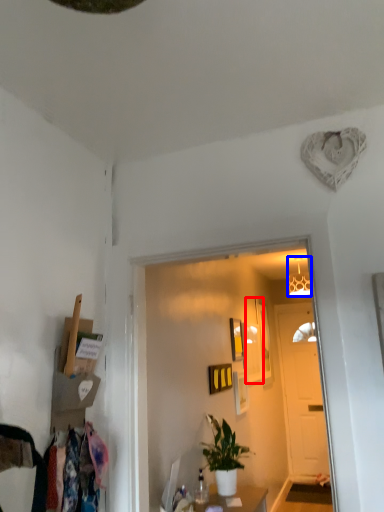
Question: Which of the following is the farthest to the observer, picture frame (highlighted by a red box) or lamp (highlighted by a blue box)?

Choices:
 (A) picture frame
 (B) lamp

Answer: (B)